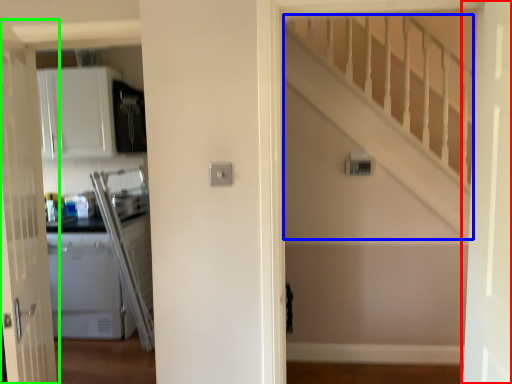
Question: Estimate the real-world distances between objects in this image. Which object is farther from door (highlighted by a red box), stairwell (highlighted by a blue box) or door (highlighted by a green box)?

Choices:
 (A) stairwell
 (B) door

Answer: (B)